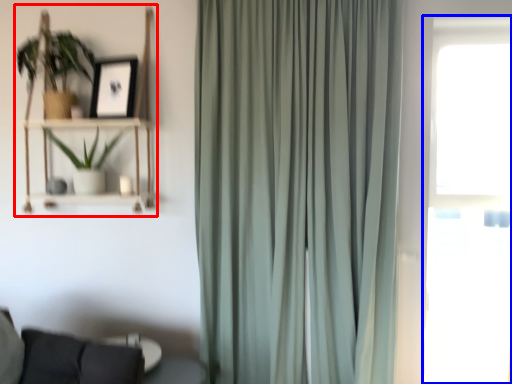
Question: Which point is closer to the camera, bookshelf (highlighted by a red box) or window (highlighted by a blue box)?

Choices:
 (A) bookshelf
 (B) window

Answer: (B)